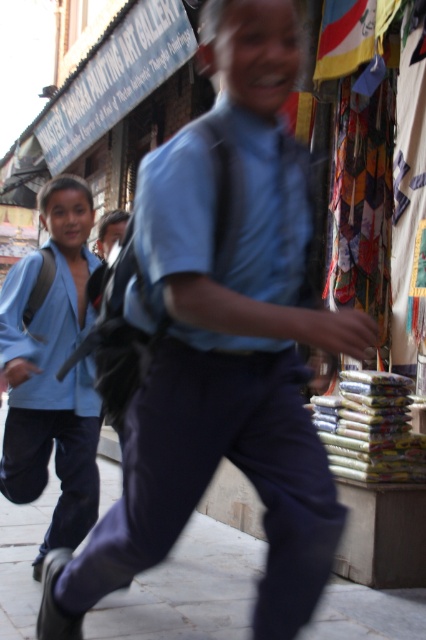
From the picture: Who is higher up, gray concrete pavement at lower center or light blue fabric jacket at left?

light blue fabric jacket at left is higher up.

Between gray concrete pavement at lower center and light blue fabric jacket at left, which one has less height?

gray concrete pavement at lower center

Where is `gray concrete pavement at lower center`? gray concrete pavement at lower center is located at coordinates (187, 589).

Where is `gray concrete pavement at lower center`? This screenshot has width=426, height=640. gray concrete pavement at lower center is located at coordinates (187, 589).

Can you confirm if blue cotton shirt at center is wider than gray concrete pavement at lower center?

Indeed, blue cotton shirt at center has a greater width compared to gray concrete pavement at lower center.

Can you confirm if blue cotton shirt at center is positioned below gray concrete pavement at lower center?

Incorrect, blue cotton shirt at center is not positioned below gray concrete pavement at lower center.

Between point (129, 474) and point (207, 630), which one is positioned behind?

Point (207, 630)

Find the location of a particular element. The image size is (426, 640). blue cotton shirt at center is located at coordinates (213, 472).

Is blue cotton shirt at center above light blue fabric jacket at left?

Yes.

I want to click on blue cotton shirt at center, so click(x=213, y=472).

Is point (267, 467) closer to viewer compared to point (80, 205)?

Yes, point (267, 467) is closer to viewer.

This screenshot has width=426, height=640. I want to click on blue cotton shirt at center, so click(213, 472).